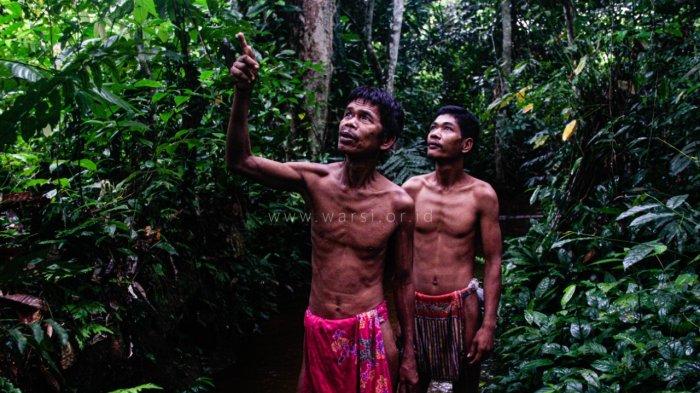
In order to click on the chest in this screenshot , I will do `click(452, 225)`, `click(438, 225)`, `click(370, 235)`, `click(337, 231)`.